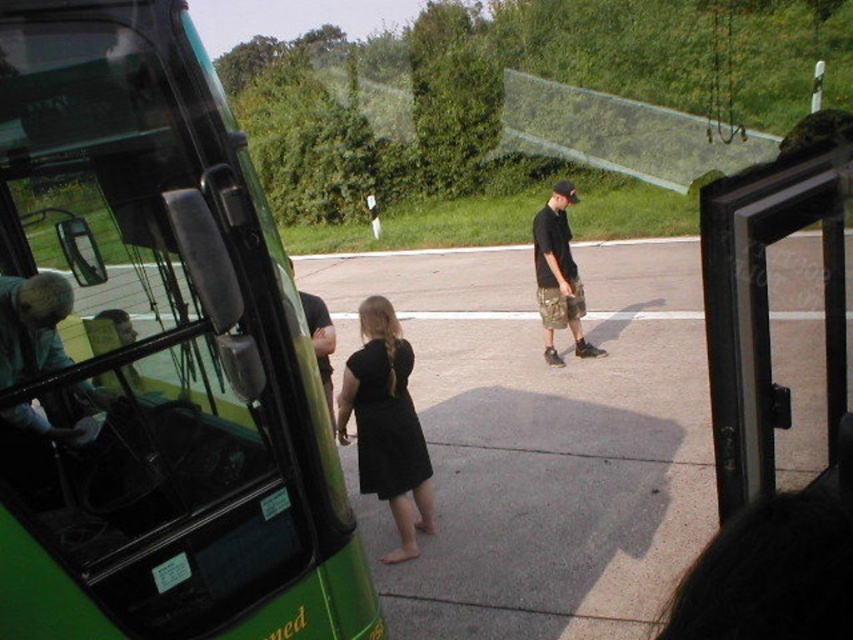
The height and width of the screenshot is (640, 853). In order to click on green matte bus at left in this screenshot , I will do `click(154, 355)`.

From the picture: Which of these two, green matte bus at left or transparent glass door at center, stands shorter?

green matte bus at left is shorter.

Find the location of `green matte bus at left`. green matte bus at left is located at coordinates (154, 355).

Is the position of transparent glass door at center less distant than that of black matte dress at center?

Yes.

Does transparent glass door at center appear over black matte dress at center?

Correct, transparent glass door at center is located above black matte dress at center.

Is point (844, 413) positioned in front of point (347, 392)?

Yes, it is in front of point (347, 392).

What are the coordinates of `transparent glass door at center` in the screenshot? It's located at (767, 298).

Is the position of transparent glass door at center more distant than that of dark blue shirt at center?

No, transparent glass door at center is in front of dark blue shirt at center.

Does transparent glass door at center appear over dark blue shirt at center?

Indeed, transparent glass door at center is positioned over dark blue shirt at center.

What do you see at coordinates (767, 298) in the screenshot?
I see `transparent glass door at center` at bounding box center [767, 298].

Where is `transparent glass door at center`? The image size is (853, 640). transparent glass door at center is located at coordinates (767, 298).